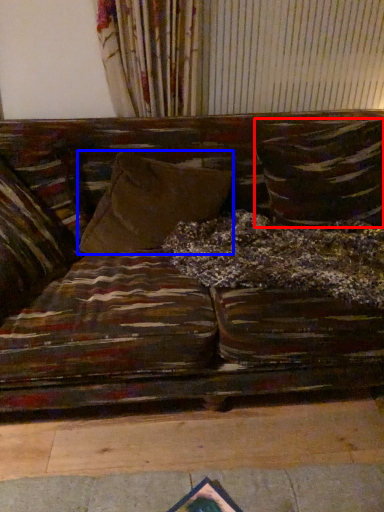
Question: Which point is closer to the camera, pillow (highlighted by a red box) or pillow (highlighted by a blue box)?

Choices:
 (A) pillow
 (B) pillow

Answer: (B)